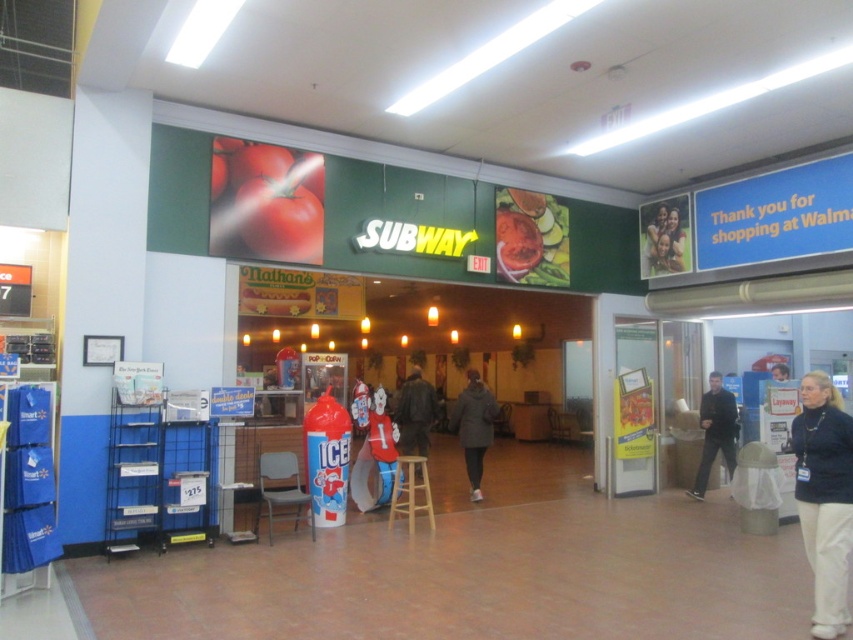
Question: Can you confirm if black fabric pants at lower right is smaller than dark gray jacket at center?

Choices:
 (A) no
 (B) yes

Answer: (A)

Question: Which point is farther to the camera?

Choices:
 (A) [x=422, y=435]
 (B) [x=473, y=387]
 (C) [x=782, y=380]

Answer: (C)

Question: Can you confirm if tomato matte at center is positioned to the left of dark gray sweater at right?

Choices:
 (A) no
 (B) yes

Answer: (B)

Question: Among these objects, which one is farthest from the camera?

Choices:
 (A) dark brown leather jacket at center
 (B) black fabric pants at lower right
 (C) dark gray sweater at right

Answer: (C)

Question: Does dark gray sweater at right come behind dark brown leather jacket at center?

Choices:
 (A) no
 (B) yes

Answer: (B)

Question: Based on their relative distances, which object is nearer to the dark gray sweater at right?

Choices:
 (A) dark brown leather jacket at center
 (B) black fabric pants at lower right
 (C) dark blue jacket at lower right
 (D) dark gray jacket at center

Answer: (C)